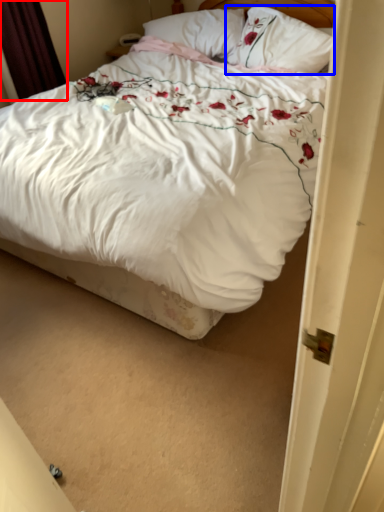
Question: Among these objects, which one is nearest to the camera, curtain (highlighted by a red box) or pillow (highlighted by a blue box)?

Choices:
 (A) curtain
 (B) pillow

Answer: (B)